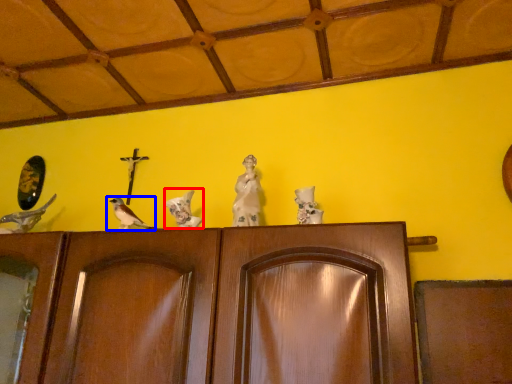
Question: Among these objects, which one is farthest to the camera, bird (highlighted by a red box) or bird (highlighted by a blue box)?

Choices:
 (A) bird
 (B) bird

Answer: (B)